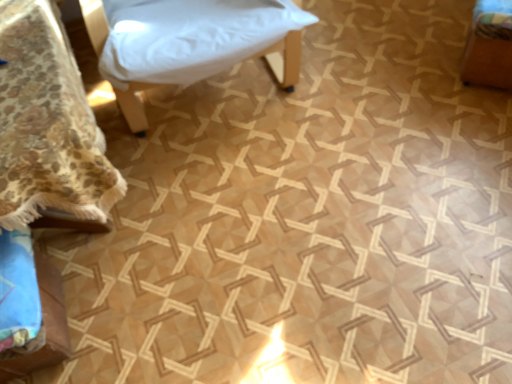
The width and height of the screenshot is (512, 384). In order to click on empty space that is in between white fabric cushion at upper center, acting as the third furniture starting from the left, and wooden box at right, acting as the 4th furniture starting from the left in this screenshot , I will do `click(365, 72)`.